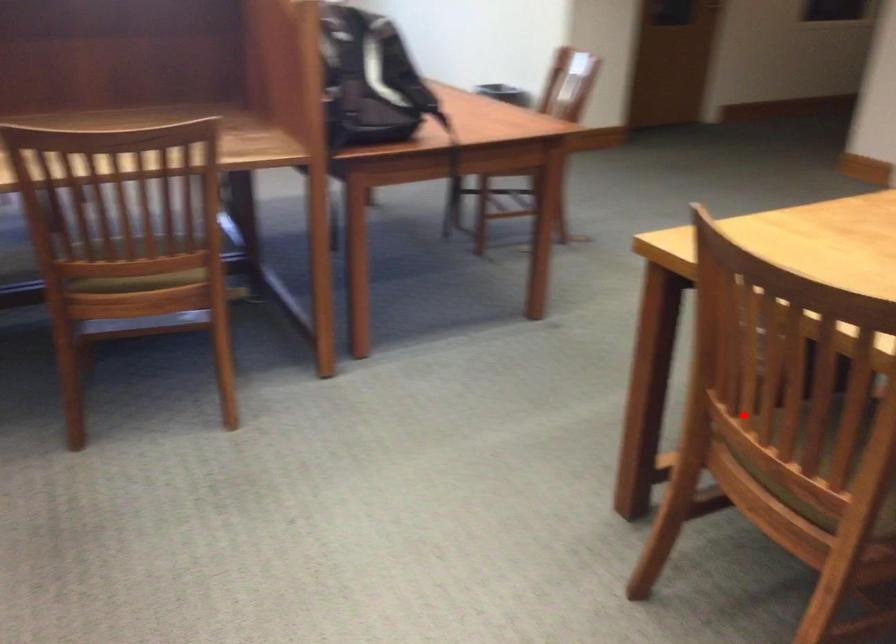
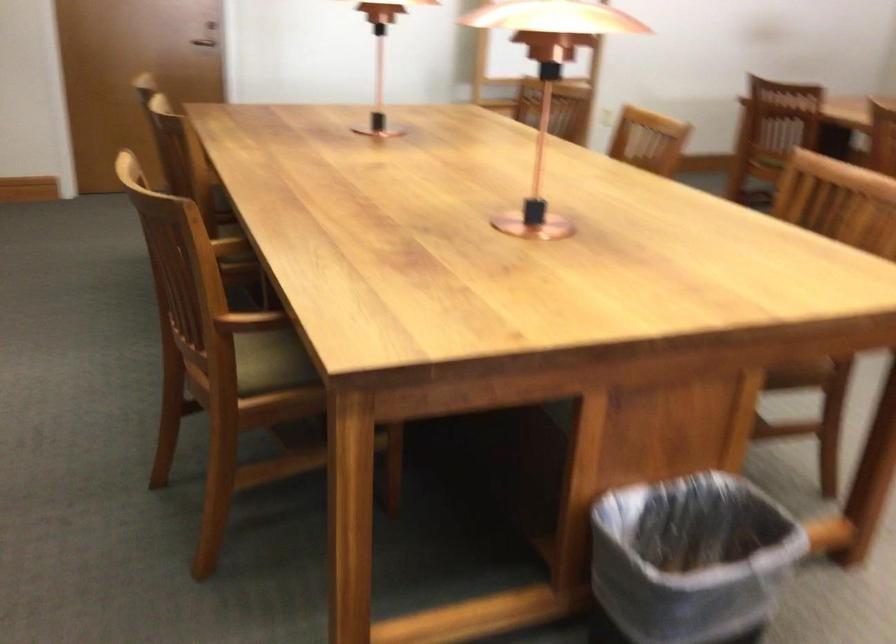
Question: A red point is marked in image1. In image2, is the corresponding 3D point closer to the camera or farther? Reply with the corresponding letter.

Choices:
 (A) The corresponding 3D point is closer.
 (B) The corresponding 3D point is farther.

Answer: (B)